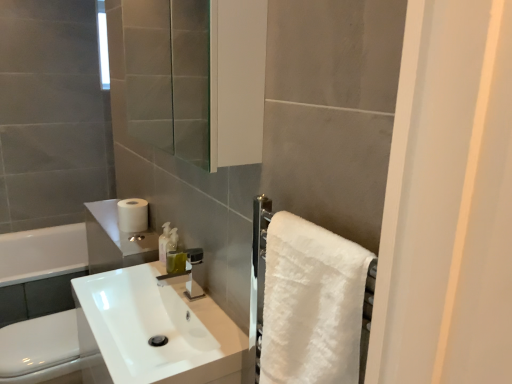
Question: Does white glossy sink at center appear on the left side of white fluffy towel at right?

Choices:
 (A) no
 (B) yes

Answer: (B)

Question: Can you see white glossy sink at center touching white fluffy towel at right?

Choices:
 (A) no
 (B) yes

Answer: (A)

Question: From the image's perspective, is white glossy sink at center located above white fluffy towel at right?

Choices:
 (A) no
 (B) yes

Answer: (A)

Question: Is the depth of white glossy sink at center less than that of white fluffy towel at right?

Choices:
 (A) yes
 (B) no

Answer: (B)

Question: Is white glossy sink at center behind white fluffy towel at right?

Choices:
 (A) yes
 (B) no

Answer: (A)

Question: Does white glossy sink at center turn towards white fluffy towel at right?

Choices:
 (A) no
 (B) yes

Answer: (A)

Question: Is translucent plastic soap dispenser at center closer to camera compared to white glossy toilet bowl at lower left?

Choices:
 (A) yes
 (B) no

Answer: (A)

Question: Is translucent plastic soap dispenser at center facing away from white glossy toilet bowl at lower left?

Choices:
 (A) yes
 (B) no

Answer: (B)

Question: Is translucent plastic soap dispenser at center wider than white glossy toilet bowl at lower left?

Choices:
 (A) yes
 (B) no

Answer: (B)

Question: Considering the relative sizes of translucent plastic soap dispenser at center and white glossy toilet bowl at lower left in the image provided, is translucent plastic soap dispenser at center bigger than white glossy toilet bowl at lower left?

Choices:
 (A) no
 (B) yes

Answer: (A)

Question: From a real-world perspective, is translucent plastic soap dispenser at center positioned over white glossy toilet bowl at lower left based on gravity?

Choices:
 (A) no
 (B) yes

Answer: (B)

Question: Is translucent plastic soap dispenser at center further to camera compared to white glossy toilet bowl at lower left?

Choices:
 (A) yes
 (B) no

Answer: (B)

Question: From the image's perspective, is white glossy toilet bowl at lower left located beneath translucent plastic soap dispenser at center?

Choices:
 (A) yes
 (B) no

Answer: (A)